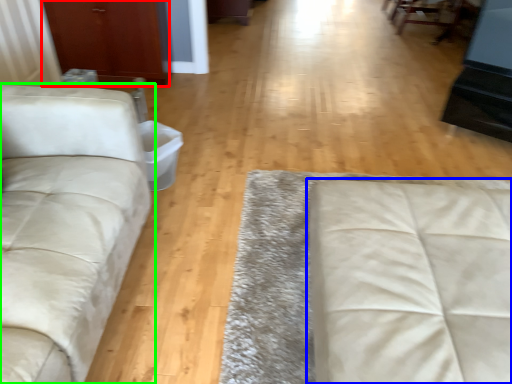
Question: Which is nearer to the armoire (highlighted by a red box)? studio couch (highlighted by a blue box) or studio couch (highlighted by a green box).

Choices:
 (A) studio couch
 (B) studio couch

Answer: (B)